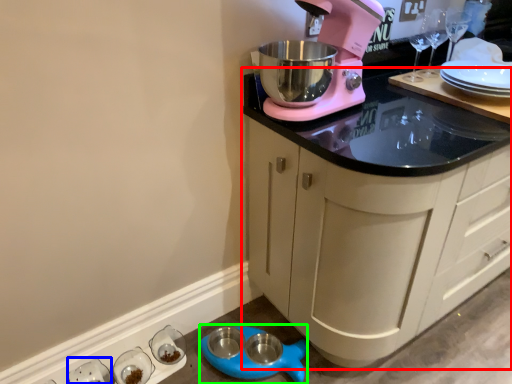
Question: Which is nearer to the cabinetry (highlighted by a red box)? tableware (highlighted by a blue box) or appliance (highlighted by a green box).

Choices:
 (A) tableware
 (B) appliance

Answer: (B)